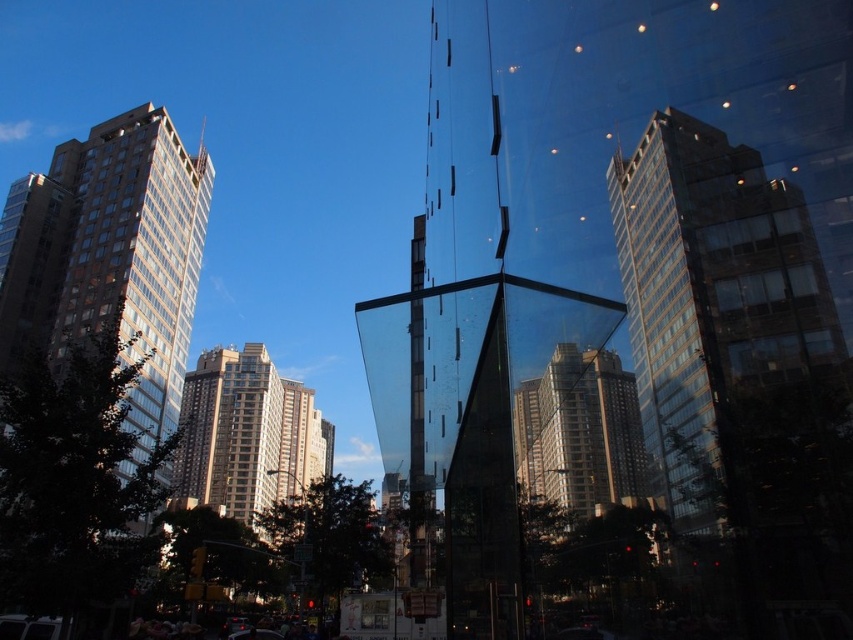
Is point (248, 476) positioned before point (583, 374)?

No.

Is beige glass building at center smaller than matte glass building at center?

No, beige glass building at center is not smaller than matte glass building at center.

Between point (231, 358) and point (537, 410), which one is positioned in front?

Point (537, 410)

Find the location of a particular element. beige glass building at center is located at coordinates (247, 436).

Is brown glass building at left further to the viewer compared to beige glass building at center?

No, brown glass building at left is in front of beige glass building at center.

Does brown glass building at left have a smaller size compared to beige glass building at center?

Yes, brown glass building at left is smaller than beige glass building at center.

The image size is (853, 640). Describe the element at coordinates (109, 259) in the screenshot. I see `brown glass building at left` at that location.

Locate an element on the screen. brown glass building at left is located at coordinates (109, 259).

Is point (149, 115) farther from viewer compared to point (612, 500)?

That is True.

Is brown glass building at left below matte glass building at center?

Incorrect, brown glass building at left is not positioned below matte glass building at center.

Measure the distance between point (x=35, y=346) and camera.

Point (x=35, y=346) and camera are 270.32 feet apart from each other.

What are the coordinates of `brown glass building at left` in the screenshot? It's located at (109, 259).